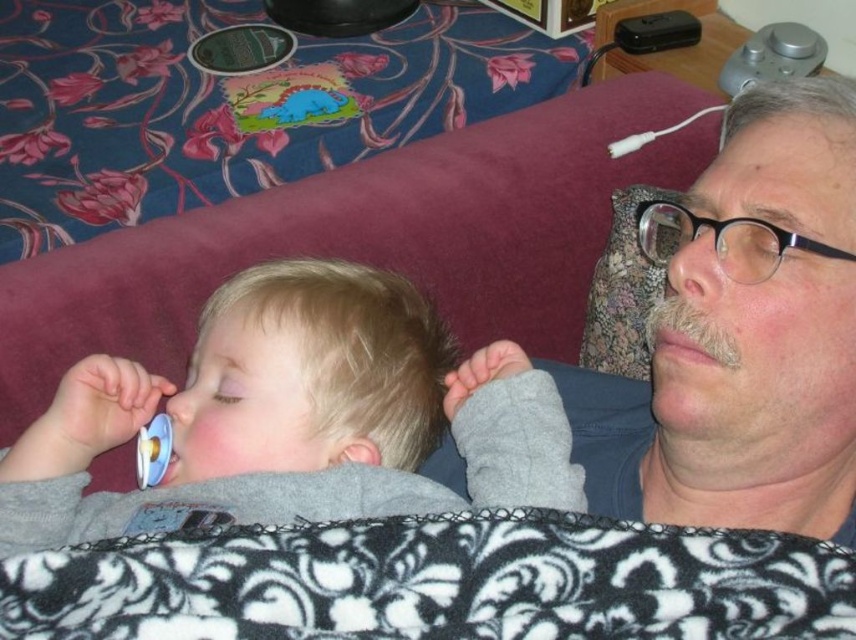
Can you confirm if matte gray shirt at upper right is thinner than white plastic pacifier at lower left?

Incorrect, matte gray shirt at upper right's width is not less than white plastic pacifier at lower left's.

Can you confirm if matte gray shirt at upper right is smaller than white plastic pacifier at lower left?

Incorrect, matte gray shirt at upper right is not smaller in size than white plastic pacifier at lower left.

Who is more distant from viewer, (698, 467) or (152, 476)?

Positioned behind is point (152, 476).

At what (x,y) coordinates should I click in order to perform the action: click on matte gray shirt at upper right. Please return your answer as a coordinate pair (x, y). Looking at the image, I should click on click(744, 336).

Between point (248, 349) and point (685, 310), which one is positioned in front?

Point (685, 310)

Is gray fleece baby at center to the left of dry skin at center from the viewer's perspective?

Correct, you'll find gray fleece baby at center to the left of dry skin at center.

The width and height of the screenshot is (856, 640). I want to click on gray fleece baby at center, so pyautogui.click(x=294, y=417).

Measure the distance between gray fleece baby at center and camera.

A distance of 22.59 inches exists between gray fleece baby at center and camera.

Does point (245, 400) come closer to viewer compared to point (159, 449)?

That is True.

Does point (360, 292) come closer to viewer compared to point (156, 460)?

No, it is not.

Identify the location of gray fleece baby at center. (294, 417).